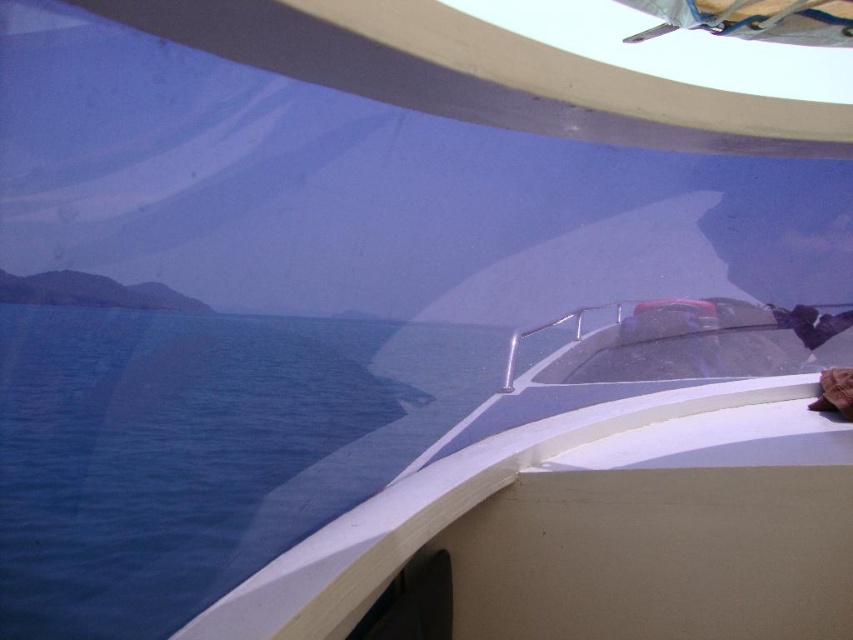
Question: Can you confirm if white glossy boat at center is positioned to the right of blue water at lower left?

Choices:
 (A) no
 (B) yes

Answer: (B)

Question: In this image, where is white glossy boat at center located relative to blue water at lower left?

Choices:
 (A) left
 (B) right

Answer: (B)

Question: Which of the following is the closest to the observer?

Choices:
 (A) blue water at lower left
 (B) white glossy boat at center

Answer: (B)

Question: Where is white glossy boat at center located in relation to blue water at lower left in the image?

Choices:
 (A) right
 (B) left

Answer: (A)

Question: Which point is farther to the camera?

Choices:
 (A) (222, 586)
 (B) (601, 570)

Answer: (A)

Question: Which object is farther from the camera taking this photo?

Choices:
 (A) blue water at lower left
 (B) white glossy boat at center

Answer: (A)